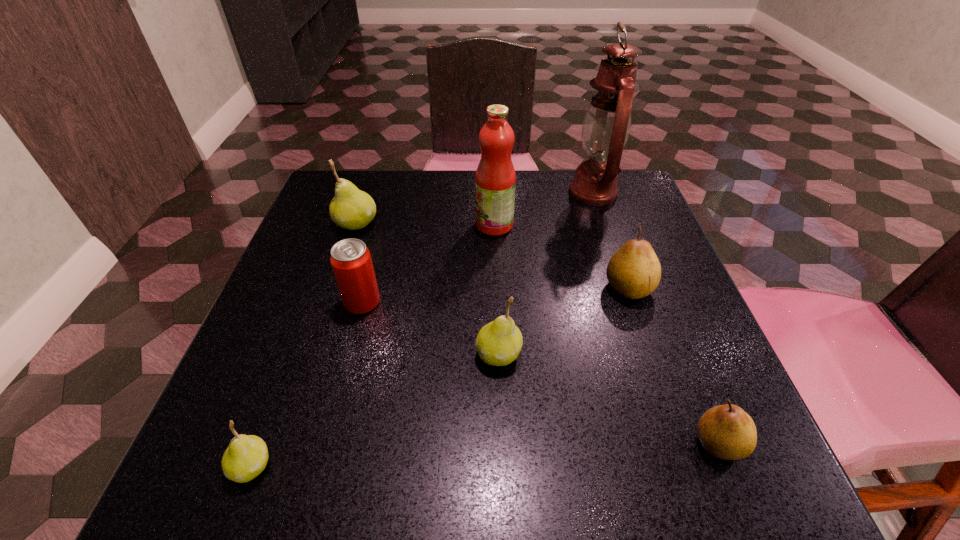
The width and height of the screenshot is (960, 540). What are the coordinates of `vacant area that lies between the red can and the seventh shortest object` in the screenshot? It's located at click(428, 264).

The width and height of the screenshot is (960, 540). Identify the location of free space between the red oil lamp and the farthest green pear. (474, 208).

Locate an element on the screen. The width and height of the screenshot is (960, 540). vacant area that lies between the smaller brown pear and the nearest green pear is located at coordinates (485, 455).

Where is `vacant area that lies between the bigger brown pear and the third farthest pear`? The width and height of the screenshot is (960, 540). vacant area that lies between the bigger brown pear and the third farthest pear is located at coordinates (564, 321).

Where is `free space between the rightmost green pear and the bigger brown pear`? The height and width of the screenshot is (540, 960). free space between the rightmost green pear and the bigger brown pear is located at coordinates (564, 321).

The image size is (960, 540). In order to click on free space between the red can and the third farthest pear in this screenshot , I will do `click(430, 328)`.

What are the coordinates of `unoccupied position between the red can and the smallest green pear` in the screenshot? It's located at (307, 384).

Where is `free space between the can and the smaller brown pear`? The image size is (960, 540). free space between the can and the smaller brown pear is located at coordinates (540, 373).

Where is `vacant space that is in between the second nearest green pear and the red can`? This screenshot has height=540, width=960. vacant space that is in between the second nearest green pear and the red can is located at coordinates (430, 328).

Choose which object is the seventh nearest neighbor to the pink fruit juice. Please provide its 2D coordinates. Your answer should be formatted as a tuple, i.e. [(x, y)], where the tuple contains the x and y coordinates of a point satisfying the conditions above.

[(246, 457)]